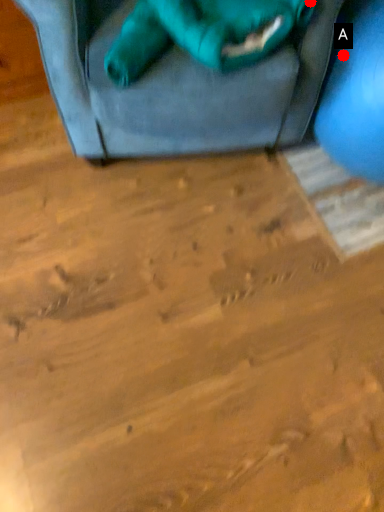
Question: Two points are circled on the image, labeled by A and B beside each circle. Which point is closer to the camera taking this photo?

Choices:
 (A) A is closer
 (B) B is closer

Answer: (B)